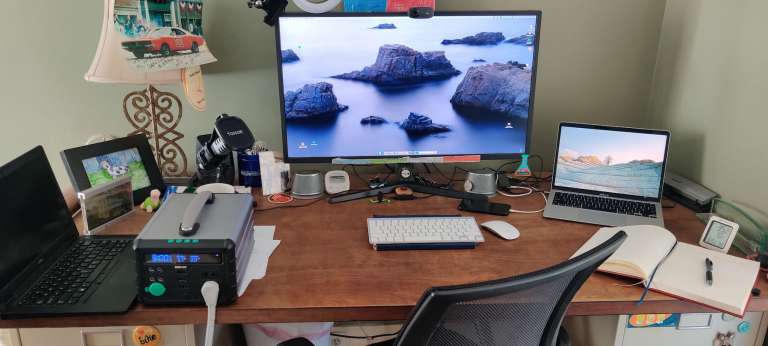
Locate an element on the screen. This screenshot has height=346, width=768. right speaker is located at coordinates (481, 183).